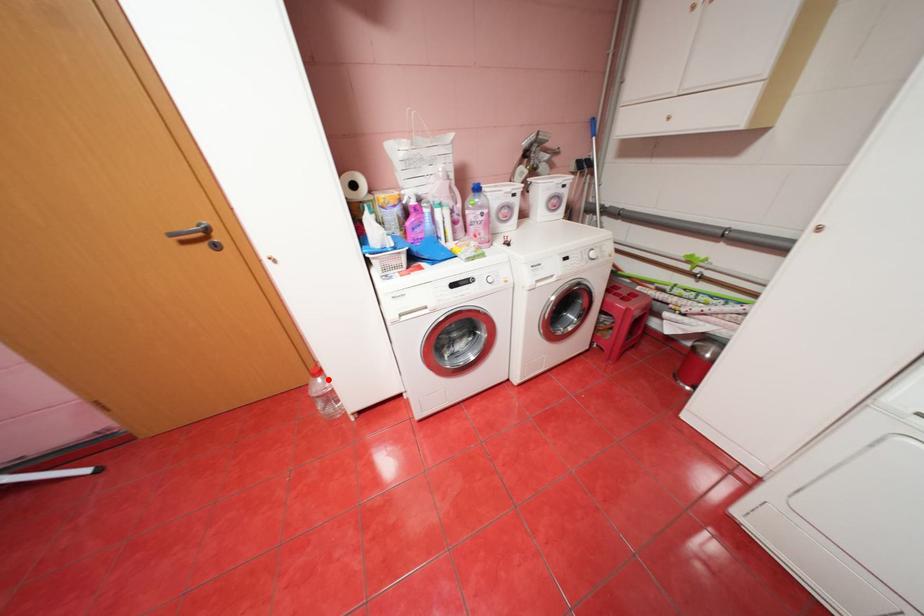
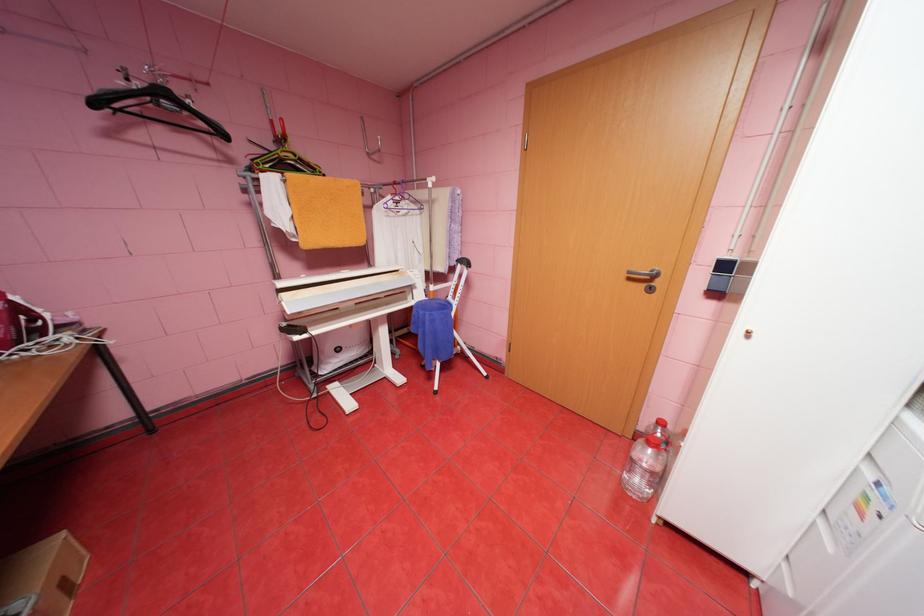
Question: I am providing you with two images of the same scene from different viewpoints. In image1, a red point is highlighted. Considering the same 3D point in image2, which of the following is correct?

Choices:
 (A) It is closer
 (B) It is farther

Answer: (A)